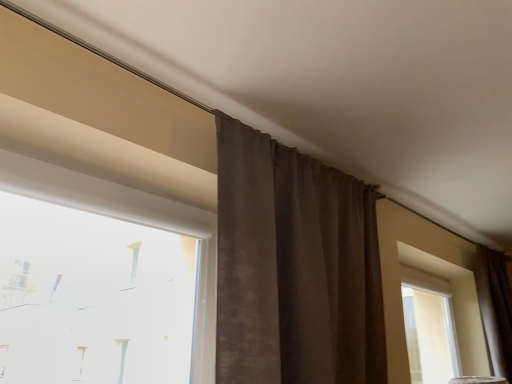
What is the approximate width of brown textured curtain at right, which is the 2th curtain in front-to-back order?

It is 10.37 inches.

Locate an element on the screen. white plastic window at upper left is located at coordinates (126, 220).

From a real-world perspective, between white plastic window at upper left and brown textured curtain at right, which ranks as the 1th curtain in right-to-left order, who is vertically lower?

white plastic window at upper left is physically lower.

Who is bigger, white plastic window at upper left or brown textured curtain at right, which ranks as the 1th curtain in right-to-left order?

brown textured curtain at right, which ranks as the 1th curtain in right-to-left order.

Is white plastic window at upper left facing towards brown textured curtain at right, which is the 2th curtain in front-to-back order?

No, white plastic window at upper left is not oriented towards brown textured curtain at right, which is the 2th curtain in front-to-back order.

From a real-world perspective, which object stands above the other?

brown textured curtain at right, which is the 2th curtain in front-to-back order.

Can you confirm if brown textured curtain at right, which ranks as the 1th curtain in right-to-left order, is shorter than white plastic window at upper left?

Incorrect, the height of brown textured curtain at right, which ranks as the 1th curtain in right-to-left order, does not fall short of that of white plastic window at upper left.

Which point is more distant from viewer, (493, 266) or (126, 189)?

Point (493, 266)

Considering the relative sizes of brown textured curtain at center, the second curtain from the back, and brown textured curtain at right, which is counted as the first curtain, starting from the back, in the image provided, is brown textured curtain at center, the second curtain from the back, taller than brown textured curtain at right, which is counted as the first curtain, starting from the back,?

Yes.

Between brown textured curtain at center, the second curtain from the back, and brown textured curtain at right, which ranks as the 1th curtain in right-to-left order, which one has larger size?

brown textured curtain at center, the second curtain from the back.

In the image, there is a brown textured curtain at center, which is counted as the 2th curtain, starting from the right. Where is `curtain below it (from the image's perspective)`? The width and height of the screenshot is (512, 384). curtain below it (from the image's perspective) is located at coordinates (495, 308).

Is brown textured curtain at center, positioned as the 1th curtain in front-to-back order, to the left or to the right of brown textured curtain at right, which is the 2th curtain in front-to-back order, in the image?

Based on their positions, brown textured curtain at center, positioned as the 1th curtain in front-to-back order, is located to the left of brown textured curtain at right, which is the 2th curtain in front-to-back order.

Considering the relative positions of white plastic window at upper left and brown textured curtain at center, which is counted as the 2th curtain, starting from the right, in the image provided, is white plastic window at upper left in front of brown textured curtain at center, which is counted as the 2th curtain, starting from the right,?

Yes, white plastic window at upper left is closer to the camera.

Can you confirm if white plastic window at upper left is positioned to the left of brown textured curtain at center, which is counted as the 2th curtain, starting from the right?

Yes.

From the picture: From the image's perspective, is white plastic window at upper left above brown textured curtain at center, which is counted as the 2th curtain, starting from the right?

Yes, from the image's perspective, white plastic window at upper left is over brown textured curtain at center, which is counted as the 2th curtain, starting from the right.

Which is correct: white plastic window at upper left is inside brown textured curtain at center, positioned as the 1th curtain in front-to-back order, or outside of it?

white plastic window at upper left is not enclosed by brown textured curtain at center, positioned as the 1th curtain in front-to-back order.

Identify the location of the 2nd curtain above the white plastic window at upper left (from a real-world perspective). (294, 267).

From a real-world perspective, is brown textured curtain at center, the second curtain from the back, positioned under white plastic window at upper left based on gravity?

No.

From the image's perspective, is brown textured curtain at center, which is counted as the 2th curtain, starting from the right, under white plastic window at upper left?

Yes, from the image's perspective, brown textured curtain at center, which is counted as the 2th curtain, starting from the right, is beneath white plastic window at upper left.

Is brown textured curtain at center, positioned as the 1th curtain in front-to-back order, looking in the opposite direction of white plastic window at upper left?

That's not correct — brown textured curtain at center, positioned as the 1th curtain in front-to-back order, is not looking away from white plastic window at upper left.

Based on the photo, considering the positions of objects brown textured curtain at right, which is counted as the first curtain, starting from the back, and brown textured curtain at center, which is counted as the 2th curtain, starting from the right, in the image provided, who is more to the left, brown textured curtain at right, which is counted as the first curtain, starting from the back, or brown textured curtain at center, which is counted as the 2th curtain, starting from the right,?

brown textured curtain at center, which is counted as the 2th curtain, starting from the right, is more to the left.

From a real-world perspective, is brown textured curtain at right, which is counted as the first curtain, starting from the back, physically located above or below brown textured curtain at center, which is counted as the 2th curtain, starting from the right?

In terms of real-world spatial position, brown textured curtain at right, which is counted as the first curtain, starting from the back, is below brown textured curtain at center, which is counted as the 2th curtain, starting from the right.

Is point (493, 295) farther from camera compared to point (276, 275)?

Yes.

Where is `curtain above the brown textured curtain at right, which is the 2th curtain in front-to-back order (from the image's perspective)`? The image size is (512, 384). curtain above the brown textured curtain at right, which is the 2th curtain in front-to-back order (from the image's perspective) is located at coordinates (294, 267).

Where is `window in front of the brown textured curtain at right, the second curtain from the left`? The image size is (512, 384). window in front of the brown textured curtain at right, the second curtain from the left is located at coordinates (126, 220).

Find the location of `window below the brown textured curtain at right, the second curtain from the left (from a real-world perspective)`. window below the brown textured curtain at right, the second curtain from the left (from a real-world perspective) is located at coordinates (126, 220).

Based on their spatial positions, is brown textured curtain at center, positioned as the 1th curtain in front-to-back order, or white plastic window at upper left closer to brown textured curtain at right, the second curtain from the left?

The object closer to brown textured curtain at right, the second curtain from the left, is brown textured curtain at center, positioned as the 1th curtain in front-to-back order.

Which object lies nearer to the anchor point brown textured curtain at center, the first curtain when ordered from left to right, white plastic window at upper left or brown textured curtain at right, which is the 2th curtain in front-to-back order?

white plastic window at upper left.

Considering their positions, is brown textured curtain at right, which is counted as the first curtain, starting from the back, positioned closer to white plastic window at upper left than brown textured curtain at center, positioned as the 1th curtain in front-to-back order?

brown textured curtain at center, positioned as the 1th curtain in front-to-back order, is closer to white plastic window at upper left.

When comparing their distances from brown textured curtain at right, which is the 2th curtain in front-to-back order, does white plastic window at upper left or brown textured curtain at center, which is counted as the 2th curtain, starting from the right, seem closer?

brown textured curtain at center, which is counted as the 2th curtain, starting from the right, lies closer to brown textured curtain at right, which is the 2th curtain in front-to-back order, than the other object.

Based on their spatial positions, is brown textured curtain at center, positioned as the 1th curtain in front-to-back order, or brown textured curtain at right, the second curtain from the left, closer to white plastic window at upper left?

Based on the image, brown textured curtain at center, positioned as the 1th curtain in front-to-back order, appears to be nearer to white plastic window at upper left.

Which object lies nearer to the anchor point brown textured curtain at center, the first curtain when ordered from left to right, brown textured curtain at right, which is counted as the first curtain, starting from the back, or white plastic window at upper left?

white plastic window at upper left.

You are a GUI agent. You are given a task and a screenshot of the screen. Output one action in this format:
    pyautogui.click(x=<x>, y=<y>)
    Task: Click on the curtain between white plastic window at upper left and brown textured curtain at right, which is the 2th curtain in front-to-back order, from left to right
    The height and width of the screenshot is (384, 512).
    Given the screenshot: What is the action you would take?
    pyautogui.click(x=294, y=267)